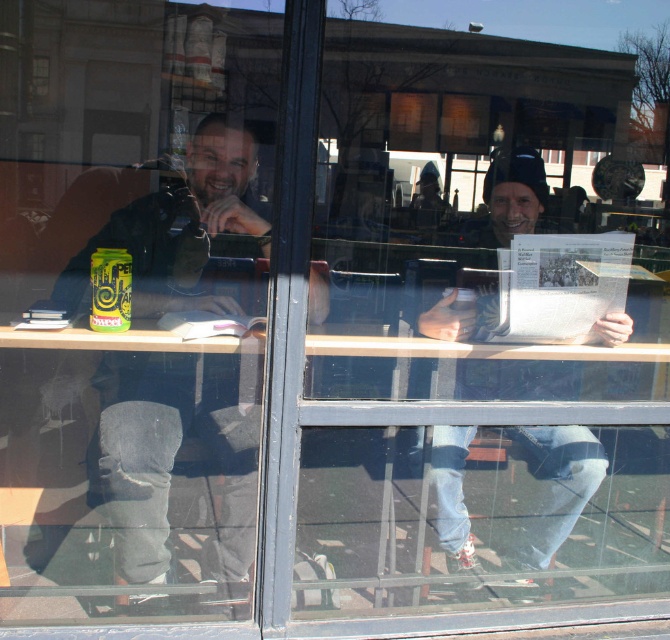
Between dark gray jeans at left and white paper newspaper at center, which one appears on the right side from the viewer's perspective?

white paper newspaper at center

Which is behind, point (259, 381) or point (580, 472)?

The point (580, 472) is more distant.

You are a GUI agent. You are given a task and a screenshot of the screen. Output one action in this format:
    pyautogui.click(x=<x>, y=<y>)
    Task: Click on the dark gray jeans at left
    The image size is (670, 640).
    Given the screenshot: What is the action you would take?
    pyautogui.click(x=176, y=454)

Which is more to the left, dark gray jeans at left or green matte soda can at center?

From the viewer's perspective, green matte soda can at center appears more on the left side.

Locate an element on the screen. The image size is (670, 640). dark gray jeans at left is located at coordinates (176, 454).

Is white paper newspaper at center thinner than green matte soda can at center?

In fact, white paper newspaper at center might be wider than green matte soda can at center.

Can you confirm if white paper newspaper at center is positioned below green matte soda can at center?

Yes.

Between point (468, 390) and point (121, 316), which one is positioned in front?

Point (121, 316) is in front.

This screenshot has width=670, height=640. I want to click on white paper newspaper at center, so click(557, 483).